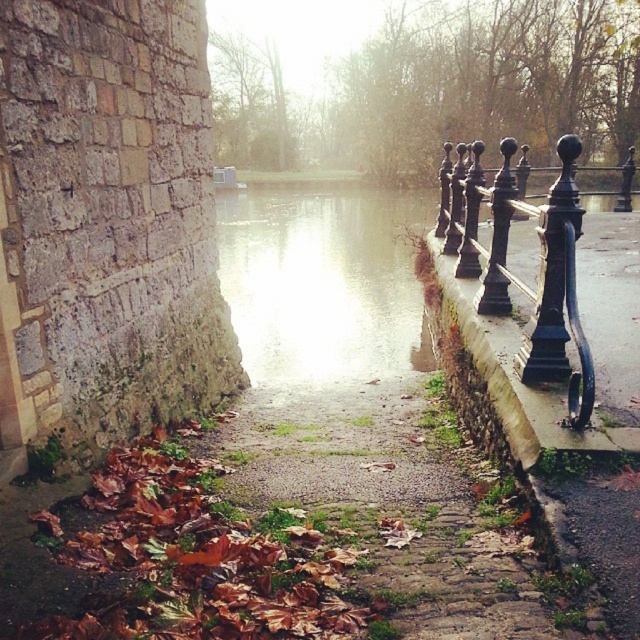
Which is above, glistening water at center or black wrought iron fence at right?

glistening water at center is above.

Between glistening water at center and black wrought iron fence at right, which one has more height?

glistening water at center

Is point (257, 376) farther from viewer compared to point (499, 260)?

Yes, it is behind point (499, 260).

The image size is (640, 640). I want to click on glistening water at center, so click(x=323, y=282).